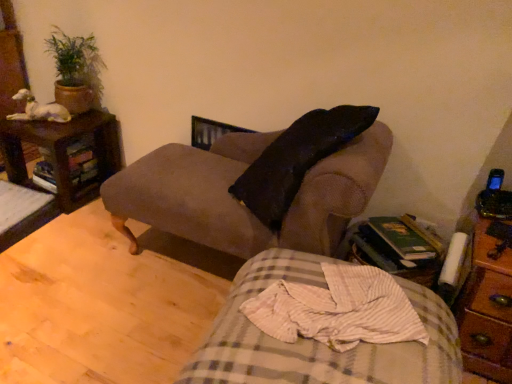
This screenshot has width=512, height=384. I want to click on plaid fabric bed at lower center, so pyautogui.click(x=317, y=342).

Where is `brown wooden nightstand at left, arranged as the second nightstand when ordered from the bottom`? brown wooden nightstand at left, arranged as the second nightstand when ordered from the bottom is located at coordinates (64, 152).

Locate an element on the screen. The height and width of the screenshot is (384, 512). plaid fabric bed at lower center is located at coordinates (317, 342).

Between suede-like brown couch at center and white matte statue at upper left, which one appears on the left side from the viewer's perspective?

Positioned to the left is white matte statue at upper left.

How much distance is there between suede-like brown couch at center and white matte statue at upper left?

The distance of suede-like brown couch at center from white matte statue at upper left is 94.97 centimeters.

From a real-world perspective, is suede-like brown couch at center positioned over white matte statue at upper left based on gravity?

Actually, suede-like brown couch at center is physically below white matte statue at upper left in the real world.

From the image's perspective, is suede-like brown couch at center over white matte statue at upper left?

No, from the image's perspective, suede-like brown couch at center is not above white matte statue at upper left.

Where is `the 1st nightstand behind the plaid fabric bed at lower center, starting your count from the anchor`? This screenshot has width=512, height=384. the 1st nightstand behind the plaid fabric bed at lower center, starting your count from the anchor is located at coordinates (486, 308).

From the image's perspective, which is above, brown wooden nightstand at right, placed as the second nightstand when sorted from top to bottom, or plaid fabric bed at lower center?

brown wooden nightstand at right, placed as the second nightstand when sorted from top to bottom, from the image's perspective.

How different are the orientations of brown wooden nightstand at right, placed as the first nightstand when sorted from front to back, and plaid fabric bed at lower center in degrees?

The angular difference between brown wooden nightstand at right, placed as the first nightstand when sorted from front to back, and plaid fabric bed at lower center is 82.5 degrees.

Considering the relative positions of wooden side table at lower right and white matte statue at upper left in the image provided, is wooden side table at lower right to the right of white matte statue at upper left from the viewer's perspective?

Indeed, wooden side table at lower right is positioned on the right side of white matte statue at upper left.

Which is in front, point (374, 257) or point (58, 105)?

The point (374, 257) is in front.

From a real-world perspective, is wooden side table at lower right on white matte statue at upper left?

No, from a real-world perspective, wooden side table at lower right is not on top of white matte statue at upper left.

Considering the relative sizes of wooden side table at lower right and suede-like brown couch at center in the image provided, is wooden side table at lower right taller than suede-like brown couch at center?

In fact, wooden side table at lower right may be shorter than suede-like brown couch at center.

Is point (391, 223) closer or farther from the camera than point (152, 224)?

Point (391, 223) is closer to the camera than point (152, 224).

Which is correct: wooden side table at lower right is inside suede-like brown couch at center, or outside of it?

wooden side table at lower right cannot be found inside suede-like brown couch at center.

Considering the sizes of objects suede-like brown couch at center and brown wooden nightstand at left, placed as the first nightstand when sorted from left to right, in the image provided, who is smaller, suede-like brown couch at center or brown wooden nightstand at left, placed as the first nightstand when sorted from left to right,?

brown wooden nightstand at left, placed as the first nightstand when sorted from left to right.

From a real-world perspective, is suede-like brown couch at center located beneath brown wooden nightstand at left, placed as the first nightstand when sorted from back to front?

No, from a real-world perspective, suede-like brown couch at center is not under brown wooden nightstand at left, placed as the first nightstand when sorted from back to front.

Considering the positions of point (359, 150) and point (18, 162), is point (359, 150) closer or farther from the camera than point (18, 162)?

Point (359, 150) appears to be closer to the viewer than point (18, 162).

Is brown wooden nightstand at left, the 1th nightstand in the top-to-bottom sequence, completely or partially inside white matte statue at upper left?

No.

Does white matte statue at upper left lie in front of brown wooden nightstand at left, placed as the first nightstand when sorted from left to right?

No, white matte statue at upper left is further to the viewer.

In terms of width, does white matte statue at upper left look wider or thinner when compared to brown wooden nightstand at left, which is the second nightstand in front-to-back order?

white matte statue at upper left is thinner than brown wooden nightstand at left, which is the second nightstand in front-to-back order.

From the image's perspective, is white matte statue at upper left over brown wooden nightstand at left, the 1th nightstand in the top-to-bottom sequence?

Indeed, from the image's perspective, white matte statue at upper left is shown above brown wooden nightstand at left, the 1th nightstand in the top-to-bottom sequence.

Are brown wooden nightstand at left, arranged as the second nightstand when ordered from the bottom, and suede-like brown couch at center beside each other?

No, brown wooden nightstand at left, arranged as the second nightstand when ordered from the bottom, is not touching suede-like brown couch at center.

Considering the positions of points (112, 155) and (331, 166), is point (112, 155) farther from camera compared to point (331, 166)?

Yes, it is behind point (331, 166).

Could suede-like brown couch at center be considered to be inside brown wooden nightstand at left, which is the second nightstand in front-to-back order?

No.

From a real-world perspective, which is physically below, brown wooden nightstand at left, placed as the first nightstand when sorted from back to front, or suede-like brown couch at center?

In real-world perspective, brown wooden nightstand at left, placed as the first nightstand when sorted from back to front, is lower.

Identify the location of studio couch below the white matte statue at upper left (from the image's perspective). point(193,195).

This screenshot has width=512, height=384. I want to click on furniture in front of the brown wooden nightstand at right, marked as the 1th nightstand in a bottom-to-top arrangement, so click(x=317, y=342).

Considering their positions, is suede-like brown couch at center positioned closer to wooden side table at lower right than brown wooden nightstand at left, arranged as the second nightstand when ordered from the bottom?

Based on the image, suede-like brown couch at center appears to be nearer to wooden side table at lower right.

Which object lies nearer to the anchor point white matte statue at upper left, suede-like brown couch at center or brown wooden nightstand at right, which ranks as the first nightstand in right-to-left order?

suede-like brown couch at center is closer to white matte statue at upper left.

Considering their positions, is white matte statue at upper left positioned closer to wooden side table at lower right than green leafy plant in pot at upper left?

Based on the image, white matte statue at upper left appears to be nearer to wooden side table at lower right.

Which object lies nearer to the anchor point green leafy plant in pot at upper left, white matte statue at upper left or plaid fabric bed at lower center?

white matte statue at upper left lies closer to green leafy plant in pot at upper left than the other object.

Consider the image. Estimate the real-world distances between objects in this image. Which object is further from brown wooden nightstand at right, marked as the 1th nightstand in a bottom-to-top arrangement, suede-like brown couch at center or wooden side table at lower right?

suede-like brown couch at center lies further to brown wooden nightstand at right, marked as the 1th nightstand in a bottom-to-top arrangement, than the other object.

In the scene shown: Looking at the image, which one is located further to brown wooden nightstand at right, placed as the first nightstand when sorted from front to back, wooden side table at lower right or suede-like brown couch at center?

suede-like brown couch at center is positioned further to the anchor brown wooden nightstand at right, placed as the first nightstand when sorted from front to back.

Estimate the real-world distances between objects in this image. Which object is further from wooden side table at lower right, brown wooden nightstand at left, which is the second nightstand in front-to-back order, or green leafy plant in pot at upper left?

The object further to wooden side table at lower right is green leafy plant in pot at upper left.

From the image, which object appears to be nearer to suede-like brown couch at center, white matte statue at upper left or green leafy plant in pot at upper left?

green leafy plant in pot at upper left.

You are a GUI agent. You are given a task and a screenshot of the screen. Output one action in this format:
    pyautogui.click(x=<x>, y=<y>)
    Task: Click on the nightstand between plaid fabric bed at lower center and wooden side table at lower right in the front-back direction
    This screenshot has height=384, width=512.
    Given the screenshot: What is the action you would take?
    pyautogui.click(x=486, y=308)

Identify the location of studio couch located between plaid fabric bed at lower center and white matte statue at upper left in the depth direction. (193, 195).

Find the location of a particular element. studio couch located between plaid fabric bed at lower center and green leafy plant in pot at upper left in the depth direction is located at coordinates (193, 195).

Where is `furniture between suede-like brown couch at center and brown wooden nightstand at right, the second nightstand in the back-to-front sequence, in the horizontal direction`? furniture between suede-like brown couch at center and brown wooden nightstand at right, the second nightstand in the back-to-front sequence, in the horizontal direction is located at coordinates (317, 342).